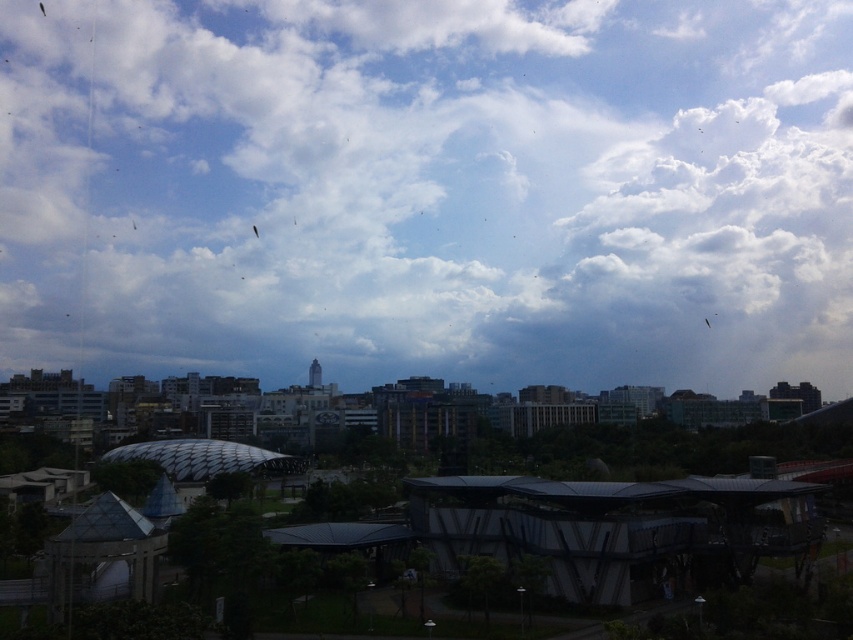
You are an architect designing a new skyscraper in this urban area. You want to ensure that the new building does not block the view of the white fluffy cloud at upper center and the translucent plastic kite at upper center from the ground. Based on their current positions, which object would require the building to be shorter to maintain its visibility?

The white fluffy cloud at upper center is located above the translucent plastic kite at upper center. To maintain visibility of both, the building must be shorter than the height required to block the lower object, which is the translucent plastic kite at upper center. Therefore, the translucent plastic kite at upper center would require the building to be shorter to remain visible.

You are an urban planner assessing the skyline. You notice the white fluffy cloud at upper center and the translucent plastic kite at upper center. How far apart are these two elements in the sky?

The white fluffy cloud at upper center and the translucent plastic kite at upper center are 89.98 meters apart.